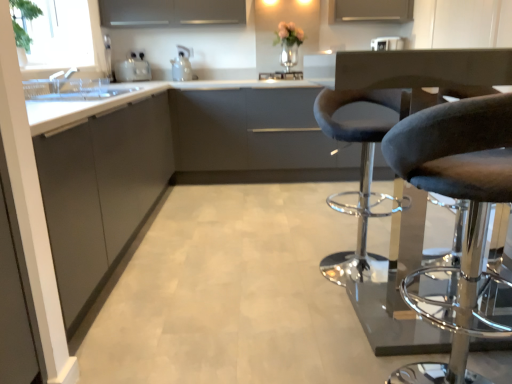
Question: Is dark gray fabric stool at right thinner than matte gray cabinet at left, acting as the 3th cabinetry starting from the back?

Choices:
 (A) yes
 (B) no

Answer: (A)

Question: Can you confirm if dark gray fabric stool at right is smaller than matte gray cabinet at left, acting as the 3th cabinetry starting from the back?

Choices:
 (A) no
 (B) yes

Answer: (B)

Question: Does dark gray fabric stool at right contain matte gray cabinet at left, which is the first cabinetry from front to back?

Choices:
 (A) no
 (B) yes

Answer: (A)

Question: From a real-world perspective, is dark gray fabric stool at right on matte gray cabinet at left, which is the first cabinetry from front to back?

Choices:
 (A) yes
 (B) no

Answer: (A)

Question: Considering the relative positions of dark gray fabric stool at right and matte gray cabinet at left, which is the first cabinetry from front to back, in the image provided, is dark gray fabric stool at right behind matte gray cabinet at left, which is the first cabinetry from front to back,?

Choices:
 (A) yes
 (B) no

Answer: (B)

Question: Is dark gray fabric stool at right at the left side of matte gray cabinet at left, acting as the 3th cabinetry starting from the back?

Choices:
 (A) yes
 (B) no

Answer: (B)

Question: Does satin silver toaster at left, placed as the third appliance when sorted from right to left, appear on the left side of white glossy toaster at upper center, the 1th appliance viewed from the right?

Choices:
 (A) no
 (B) yes

Answer: (B)

Question: Can you confirm if satin silver toaster at left, which ranks as the first appliance in left-to-right order, is shorter than white glossy toaster at upper center, the 1th appliance viewed from the right?

Choices:
 (A) no
 (B) yes

Answer: (A)

Question: Is satin silver toaster at left, placed as the third appliance when sorted from right to left, oriented away from white glossy toaster at upper center, the 1th appliance viewed from the right?

Choices:
 (A) no
 (B) yes

Answer: (A)

Question: Is satin silver toaster at left, placed as the third appliance when sorted from right to left, surrounding white glossy toaster at upper center, the 1th appliance viewed from the right?

Choices:
 (A) yes
 (B) no

Answer: (B)

Question: Could you tell me if satin silver toaster at left, placed as the third appliance when sorted from right to left, is turned towards white glossy toaster at upper center, the 1th appliance viewed from the right?

Choices:
 (A) yes
 (B) no

Answer: (B)

Question: Considering the relative sizes of satin silver toaster at left, which ranks as the first appliance in left-to-right order, and white glossy toaster at upper center, the 1th appliance viewed from the right, in the image provided, is satin silver toaster at left, which ranks as the first appliance in left-to-right order, bigger than white glossy toaster at upper center, the 1th appliance viewed from the right,?

Choices:
 (A) no
 (B) yes

Answer: (B)

Question: Is gray fabric swivel chair at right further to the viewer compared to satin silver toaster at left, which ranks as the first appliance in left-to-right order?

Choices:
 (A) no
 (B) yes

Answer: (A)